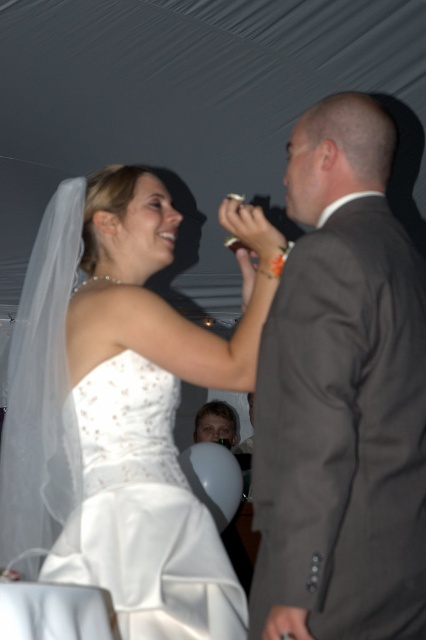
Is white satin dress at upper left bigger than white satin wedding dress at center?

Indeed, white satin dress at upper left has a larger size compared to white satin wedding dress at center.

Describe the element at coordinates (120, 408) in the screenshot. I see `white satin dress at upper left` at that location.

Describe the element at coordinates (120, 408) in the screenshot. Image resolution: width=426 pixels, height=640 pixels. I see `white satin dress at upper left` at that location.

Identify the location of white satin dress at upper left. (120, 408).

Between matte gray suit at right and white satin wedding dress at center, which one appears on the left side from the viewer's perspective?

Positioned to the left is white satin wedding dress at center.

Is the position of matte gray suit at right more distant than that of white satin wedding dress at center?

No, it is in front of white satin wedding dress at center.

Find the location of a particular element. matte gray suit at right is located at coordinates (342, 397).

Is white satin dress at upper left positioned at the back of matte gray suit at right?

Yes.

Can you confirm if white satin dress at upper left is wider than matte gray suit at right?

Correct, the width of white satin dress at upper left exceeds that of matte gray suit at right.

Who is more distant from viewer, (141,520) or (336,182)?

The point (141,520) is more distant.

At what (x,y) coordinates should I click in order to perform the action: click on white satin dress at upper left. Please return your answer as a coordinate pair (x, y). The height and width of the screenshot is (640, 426). Looking at the image, I should click on (120, 408).